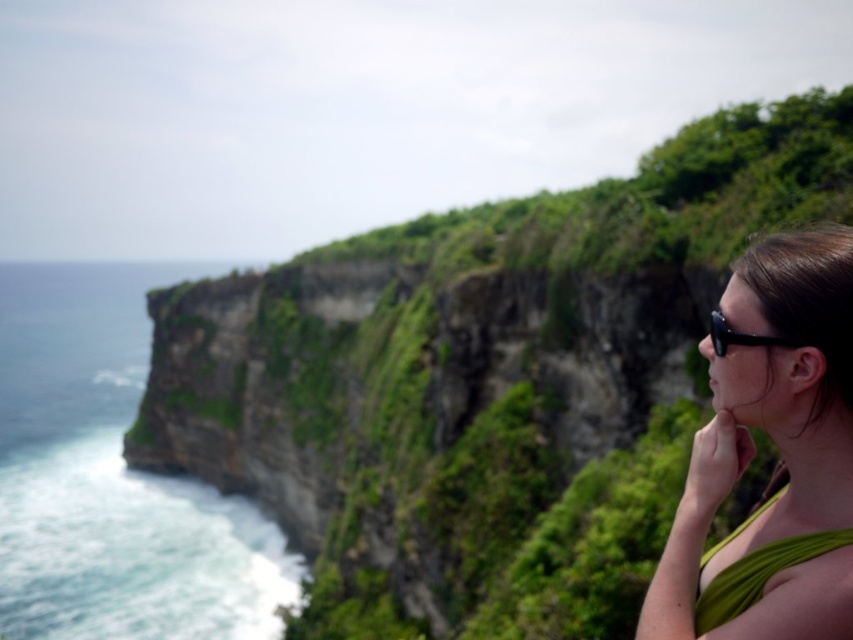
You are a fashion designer analyzing the coastal scene. You need to determine which item of clothing or accessory on the woman at the right side has a greater horizontal span. Which one is wider between the green fabric top at right and the black plastic goggles at right?

The green fabric top at right is wider than the black plastic goggles at right according to the description provided.

You are a hiker who wants to take a photo of the black plastic goggles at right without the green leafy vegetation at center blocking the view. Is there a way to do this by moving left or right?

The green leafy vegetation at center is much taller than the black plastic goggles at right, so moving to the right would position you closer to the goggles and away from the vegetation, potentially allowing an unobstructed view.